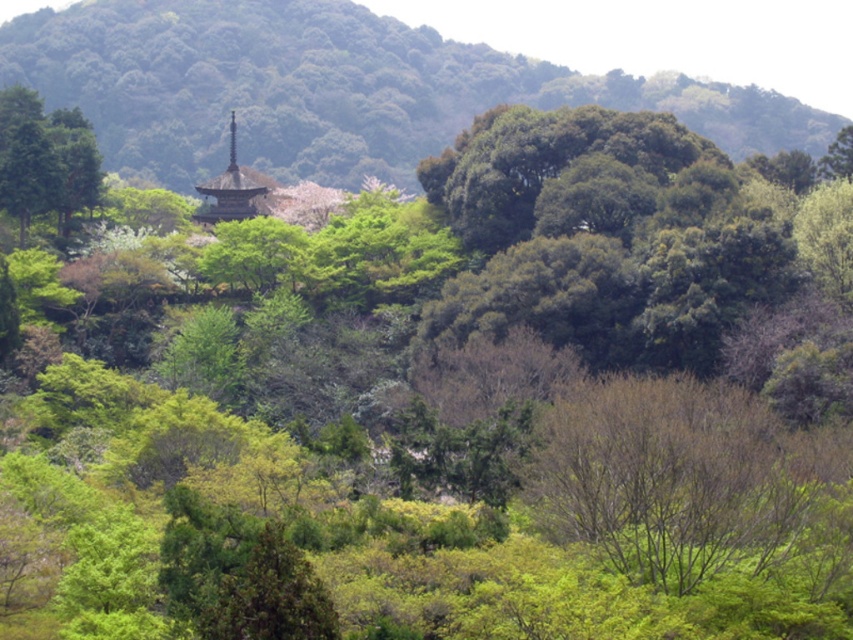
Which is below, green leafy hillside at upper center or bare branches at center?

bare branches at center is lower down.

Is green leafy hillside at upper center positioned in front of bare branches at center?

No.

The image size is (853, 640). I want to click on green leafy hillside at upper center, so click(329, 88).

Where is `green leafy hillside at upper center`? This screenshot has width=853, height=640. green leafy hillside at upper center is located at coordinates (329, 88).

How far apart are green leafy hillside at upper center and dark brown wooden spire at center?

The distance of green leafy hillside at upper center from dark brown wooden spire at center is 304.81 meters.

Does point (335, 76) come farther from viewer compared to point (210, 186)?

Yes, point (335, 76) is farther from viewer.

Which is in front, point (341, 88) or point (241, 189)?

Positioned in front is point (241, 189).

Locate an element on the screen. green leafy hillside at upper center is located at coordinates (329, 88).

Is the position of bare branches at center more distant than that of dark brown wooden spire at center?

No.

Does bare branches at center have a smaller size compared to dark brown wooden spire at center?

Correct, bare branches at center occupies less space than dark brown wooden spire at center.

Locate an element on the screen. This screenshot has width=853, height=640. bare branches at center is located at coordinates (668, 477).

Image resolution: width=853 pixels, height=640 pixels. What are the coordinates of `bare branches at center` in the screenshot? It's located at (668, 477).